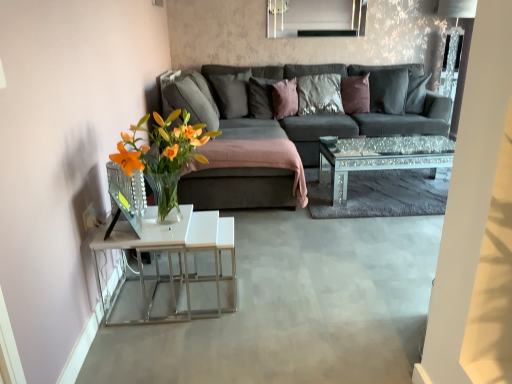
Question: Is velvet brown pillow at center, which is the 4th pillow in left-to-right order, far away from sparkly glass coffee table at center?

Choices:
 (A) no
 (B) yes

Answer: (B)

Question: Is velvet brown pillow at center, which is the 4th pillow in left-to-right order, at the right side of sparkly glass coffee table at center?

Choices:
 (A) no
 (B) yes

Answer: (A)

Question: Does velvet brown pillow at center, the second pillow when ordered from right to left, have a greater width compared to sparkly glass coffee table at center?

Choices:
 (A) no
 (B) yes

Answer: (A)

Question: Does velvet brown pillow at center, which is the 4th pillow in left-to-right order, appear on the left side of sparkly glass coffee table at center?

Choices:
 (A) no
 (B) yes

Answer: (B)

Question: Is velvet brown pillow at center, which is the 4th pillow in left-to-right order, facing towards sparkly glass coffee table at center?

Choices:
 (A) yes
 (B) no

Answer: (A)

Question: In terms of width, does dark gray fabric pillow at center, which is counted as the 1th pillow, starting from the right, look wider or thinner when compared to satin brown pillow at center, the fourth pillow positioned from the right?

Choices:
 (A) thin
 (B) wide

Answer: (B)

Question: Is dark gray fabric pillow at center, which is counted as the 1th pillow, starting from the right, inside or outside of satin brown pillow at center, the fourth pillow positioned from the right?

Choices:
 (A) inside
 (B) outside

Answer: (B)

Question: In the image, is dark gray fabric pillow at center, which appears as the 5th pillow when viewed from the left, positioned in front of or behind satin brown pillow at center, the fourth pillow positioned from the right?

Choices:
 (A) front
 (B) behind

Answer: (A)

Question: From their relative heights in the image, would you say dark gray fabric pillow at center, which is counted as the 1th pillow, starting from the right, is taller or shorter than satin brown pillow at center, the fourth pillow positioned from the right?

Choices:
 (A) tall
 (B) short

Answer: (A)

Question: Considering the positions of sparkly glass coffee table at center and dark gray fabric pillow at center, which is counted as the 1th pillow, starting from the right, in the image, is sparkly glass coffee table at center taller or shorter than dark gray fabric pillow at center, which is counted as the 1th pillow, starting from the right,?

Choices:
 (A) short
 (B) tall

Answer: (A)

Question: In the image, is sparkly glass coffee table at center positioned in front of or behind dark gray fabric pillow at center, which appears as the 5th pillow when viewed from the left?

Choices:
 (A) front
 (B) behind

Answer: (A)

Question: From a real-world perspective, is sparkly glass coffee table at center positioned above or below dark gray fabric pillow at center, which is counted as the 1th pillow, starting from the right?

Choices:
 (A) above
 (B) below

Answer: (B)

Question: From the image's perspective, is sparkly glass coffee table at center positioned above or below dark gray fabric pillow at center, which appears as the 5th pillow when viewed from the left?

Choices:
 (A) below
 (B) above

Answer: (A)

Question: Based on their positions, is purple velvet pillow at center, which is the third pillow from left to right, located to the left or right of satin brown pillow at center, marked as the second pillow in a left-to-right arrangement?

Choices:
 (A) right
 (B) left

Answer: (A)

Question: Do you think purple velvet pillow at center, which is counted as the third pillow, starting from the right, is within satin brown pillow at center, marked as the second pillow in a left-to-right arrangement, or outside of it?

Choices:
 (A) outside
 (B) inside

Answer: (A)